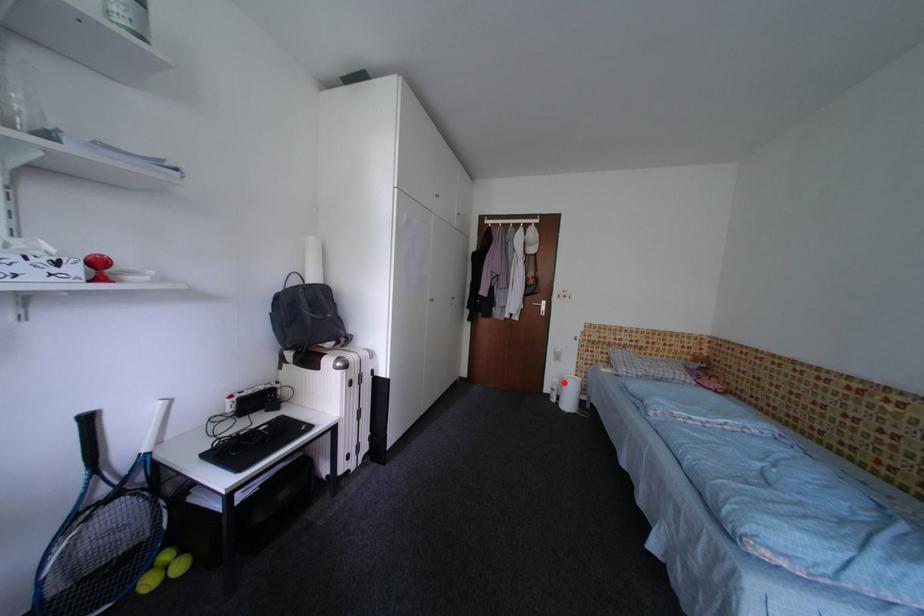
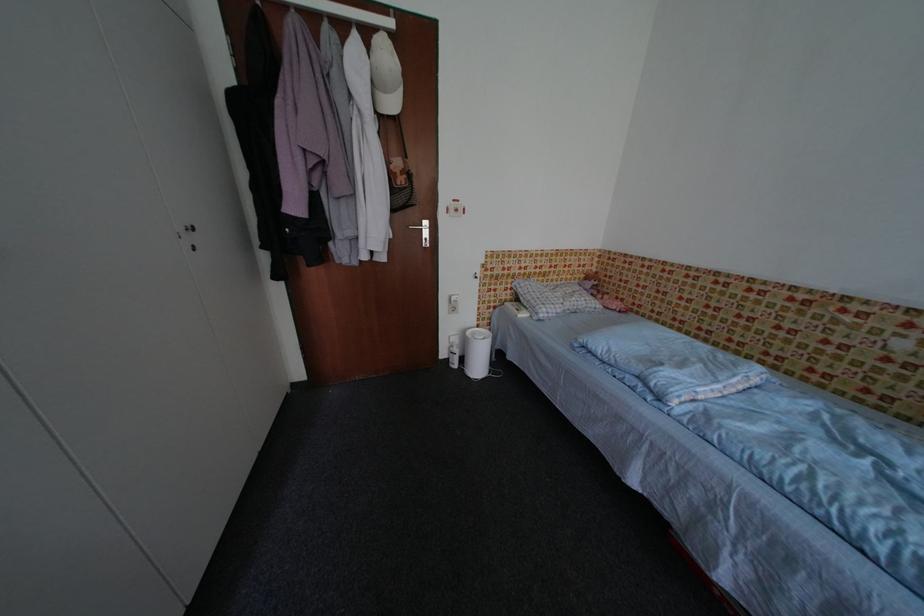
Where in the second image is the point corresponding to the highlighted location from the first image?

(464, 342)